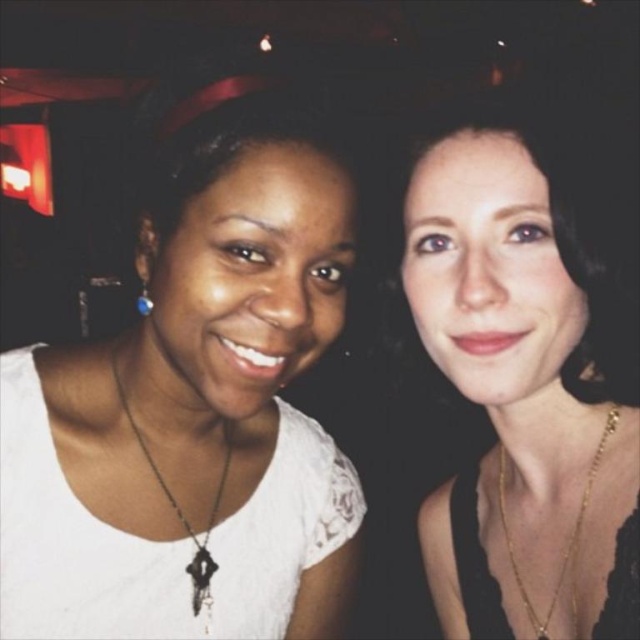
You are taking a photo of two people and need to adjust the lighting. The person on the left has a black matte key pendant at center and the person on the right has matte black hair at upper right. Which object is positioned to the right side of the other?

The matte black hair at upper right is to the right of the black matte key pendant at center.

You are taking a photo of two people standing in a room. You want to focus on the person closer to the camera. Which coordinate point should you focus on, point (x=300, y=220) or point (x=572, y=588)?

Point (x=300, y=220) is closer to the camera than point (x=572, y=588), so you should focus on point (x=300, y=220) to capture the person closer to the camera.